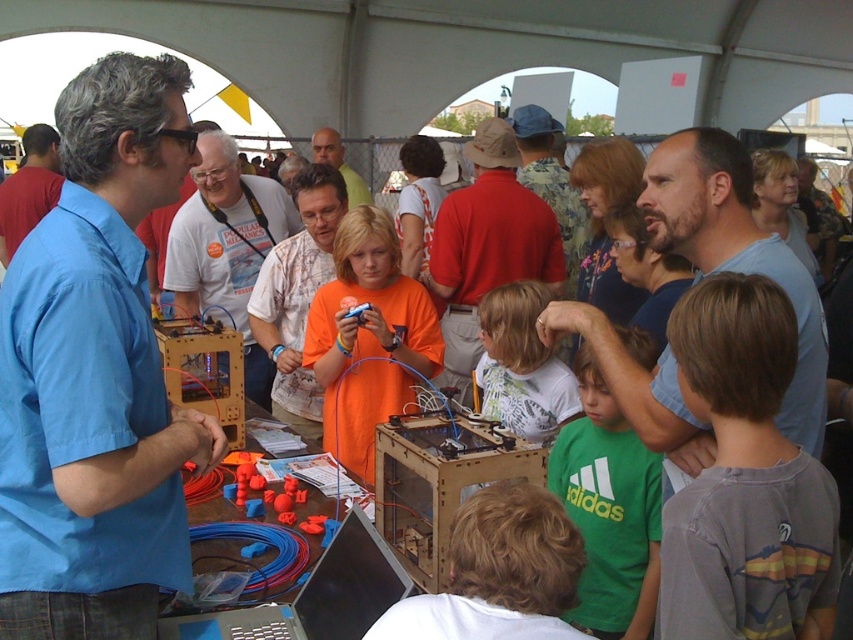
Can you confirm if matte orange shirt at center is positioned above matte blue shirt at left?

Incorrect, matte orange shirt at center is not positioned above matte blue shirt at left.

Does matte orange shirt at center have a larger size compared to matte blue shirt at left?

Correct, matte orange shirt at center is larger in size than matte blue shirt at left.

Between point (316, 280) and point (48, 193), which one is positioned in front?

Point (316, 280)

The width and height of the screenshot is (853, 640). Identify the location of matte orange shirt at center. (297, 296).

Is point (100, 428) positioned after point (653, 484)?

No, (100, 428) is closer to viewer.

I want to click on blue shirt at left, so click(x=96, y=374).

Where is `blue shirt at left`? blue shirt at left is located at coordinates (96, 374).

Which is above, white shirt at center or matte blue shirt at left?

matte blue shirt at left is higher up.

Between white shirt at center and matte blue shirt at left, which one has less height?

matte blue shirt at left is shorter.

The width and height of the screenshot is (853, 640). I want to click on white shirt at center, so [225, 248].

Find the location of a particular element. Image resolution: width=853 pixels, height=640 pixels. white shirt at center is located at coordinates (225, 248).